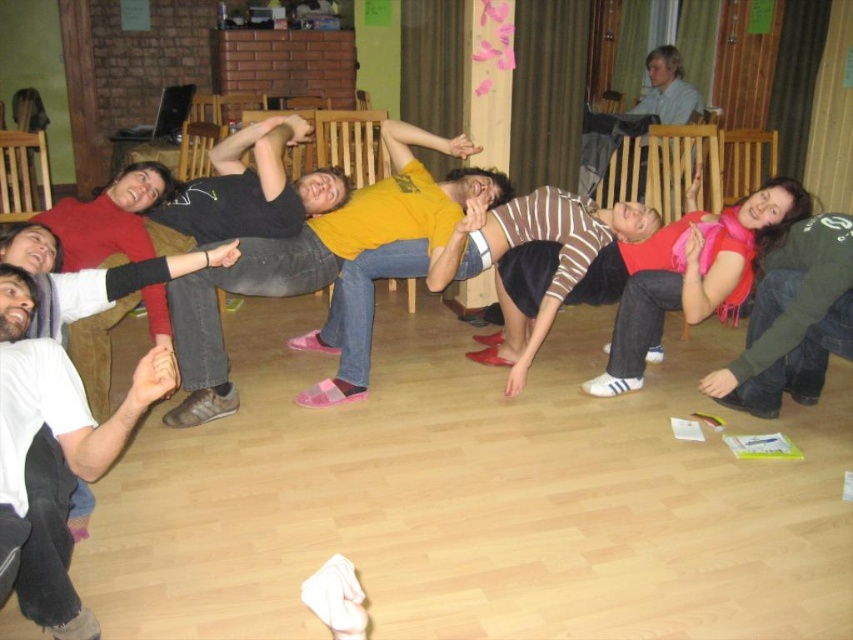
You are standing in the room and want to move from the white cotton shirt at lower left to the green fuzzy sweater at right. Which direction should you move to get closer to the sweater?

To move from the white cotton shirt at lower left to the green fuzzy sweater at right, you should move to the right since the white cotton shirt at lower left is positioned to the left of the green fuzzy sweater at right.

You are standing in the room and want to hand a gift to the person wearing the white cotton shirt at lower left and the person wearing the green fuzzy sweater at right. Which person should you approach first to give the gift without moving around furniture?

You should approach the person wearing the white cotton shirt at lower left first because they are closer to you than the green fuzzy sweater at right, so you can reach them without moving around furniture.

You are standing in the room and want to pick up the pink scarf at center and the green fuzzy sweater at right. Which item will you need to reach further to grab?

The green fuzzy sweater at right is further away from you than the pink scarf at center, so you will need to reach further to grab the green fuzzy sweater at right.